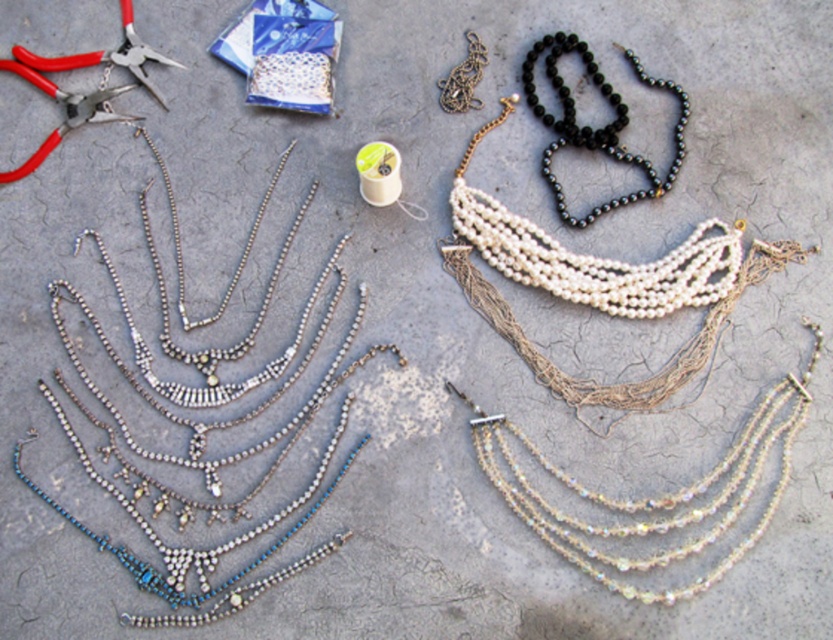
Can you confirm if white pearl necklace at upper center is positioned above black beads necklace at upper center?

No.

Does white pearl necklace at upper center appear on the left side of black beads necklace at upper center?

Indeed, white pearl necklace at upper center is positioned on the left side of black beads necklace at upper center.

Locate an element on the screen. This screenshot has height=640, width=833. white pearl necklace at upper center is located at coordinates (624, 381).

Which is above, black beads necklace at upper center or red plastic pliers at upper left?

Positioned higher is red plastic pliers at upper left.

Between point (562, 42) and point (10, 173), which one is positioned in front?

Point (10, 173) is more forward.

I want to click on black beads necklace at upper center, so click(x=599, y=128).

Does iridescent glass necklace at center have a larger size compared to white pearl necklace at upper center?

No, iridescent glass necklace at center is not bigger than white pearl necklace at upper center.

Who is more distant from viewer, [752,454] or [474,248]?

Positioned behind is point [474,248].

Locate an element on the screen. iridescent glass necklace at center is located at coordinates tap(654, 499).